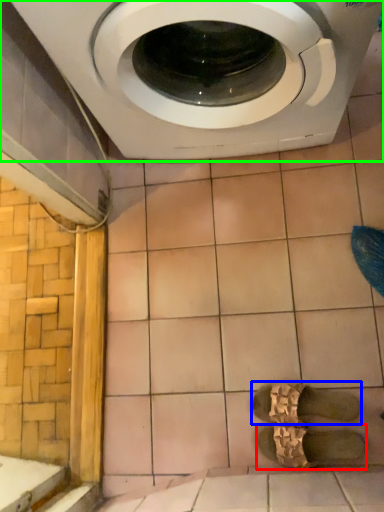
Question: Based on their relative distances, which object is nearer to shoe (highlighted by a red box)? Choose from shoe (highlighted by a blue box) and washing machine (highlighted by a green box).

Choices:
 (A) shoe
 (B) washing machine

Answer: (A)